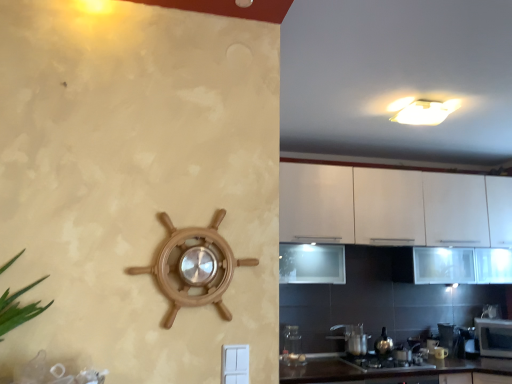
Question: From the image's perspective, is metallic silver kettle at lower right, which is counted as the third appliance, starting from the back, over wooden ship wheel at center, which is the 6th appliance in right-to-left order?

Choices:
 (A) yes
 (B) no

Answer: (B)

Question: Does metallic silver kettle at lower right, positioned as the 4th appliance in front-to-back order, have a lesser height compared to wooden ship wheel at center, arranged as the first appliance when viewed from the front?

Choices:
 (A) no
 (B) yes

Answer: (B)

Question: Could wooden ship wheel at center, acting as the 6th appliance starting from the bottom, be considered to be inside metallic silver kettle at lower right, the third appliance positioned from the right?

Choices:
 (A) no
 (B) yes

Answer: (A)

Question: Can you confirm if metallic silver kettle at lower right, the fourth appliance positioned from the left, is thinner than wooden ship wheel at center, which is the sixth appliance in back-to-front order?

Choices:
 (A) yes
 (B) no

Answer: (B)

Question: Is metallic silver kettle at lower right, which is counted as the third appliance, starting from the back, to the right of wooden ship wheel at center, which is the sixth appliance in back-to-front order, from the viewer's perspective?

Choices:
 (A) no
 (B) yes

Answer: (B)

Question: From a real-world perspective, does metallic silver kettle at lower right, which is counted as the 4th appliance, starting from the top, stand above wooden ship wheel at center, which appears as the 1th appliance when viewed from the left?

Choices:
 (A) no
 (B) yes

Answer: (A)

Question: Is black glossy countertop at lower center facing away from transparent glass jar at lower center, which is the second appliance from top to bottom?

Choices:
 (A) yes
 (B) no

Answer: (B)

Question: Does black glossy countertop at lower center have a lesser width compared to transparent glass jar at lower center, the second appliance in the front-to-back sequence?

Choices:
 (A) no
 (B) yes

Answer: (A)

Question: Does black glossy countertop at lower center lie in front of transparent glass jar at lower center, which is the 2th appliance from left to right?

Choices:
 (A) no
 (B) yes

Answer: (B)

Question: Is black glossy countertop at lower center taller than transparent glass jar at lower center, the second appliance in the front-to-back sequence?

Choices:
 (A) yes
 (B) no

Answer: (A)

Question: Does black glossy countertop at lower center have a smaller size compared to transparent glass jar at lower center, which is the 2th appliance from left to right?

Choices:
 (A) yes
 (B) no

Answer: (B)

Question: From a real-world perspective, is black glossy countertop at lower center over transparent glass jar at lower center, acting as the fifth appliance starting from the bottom?

Choices:
 (A) no
 (B) yes

Answer: (A)

Question: From a real-world perspective, is black glossy countertop at lower center over metallic silver toaster at lower right, marked as the first appliance in a right-to-left arrangement?

Choices:
 (A) no
 (B) yes

Answer: (A)